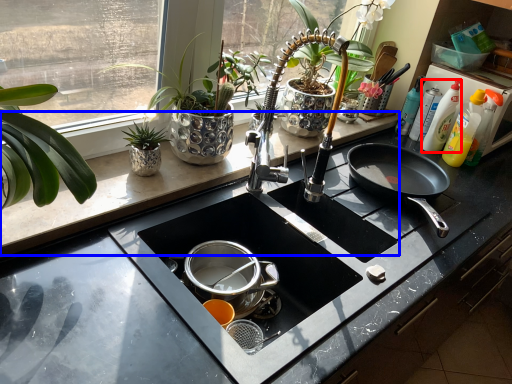
Question: Which object appears farthest to the camera in this image, cleaning product (highlighted by a red box) or counter top (highlighted by a blue box)?

Choices:
 (A) cleaning product
 (B) counter top

Answer: (A)